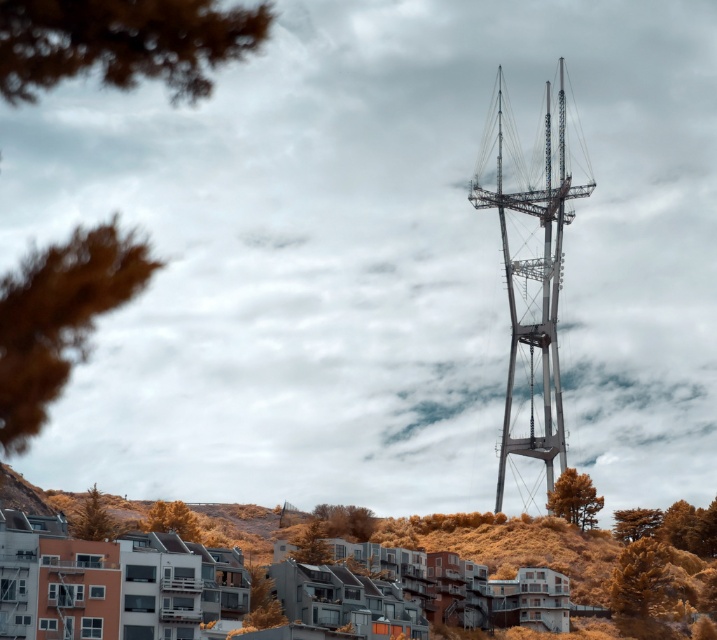
Locate an element on the screen. This screenshot has width=717, height=640. brown fuzzy bush at left is located at coordinates (57, 317).

Is point (24, 268) farther from camera compared to point (326, 524)?

No, (24, 268) is closer to viewer.

Which is in front, point (19, 358) or point (364, 529)?

Positioned in front is point (19, 358).

At what (x,y) coordinates should I click in order to perform the action: click on brown fuzzy bush at left. Please return your answer as a coordinate pair (x, y). Image resolution: width=717 pixels, height=640 pixels. Looking at the image, I should click on (57, 317).

In the scene shown: Which is above, golden textured tree at lower left or green textured tree at lower right?

golden textured tree at lower left is above.

Does golden textured tree at lower left lie behind green textured tree at lower right?

No, golden textured tree at lower left is in front of green textured tree at lower right.

Which is behind, point (250, 612) or point (637, 508)?

The point (637, 508) is behind.

Find the location of a particular element. This screenshot has height=640, width=717. golden textured tree at lower left is located at coordinates (262, 600).

In the scene shown: Can you confirm if green matte tree at lower right is positioned to the left of golden textured pine tree at lower left?

Incorrect, green matte tree at lower right is not on the left side of golden textured pine tree at lower left.

Who is positioned more to the right, green matte tree at lower right or golden textured pine tree at lower left?

green matte tree at lower right

Image resolution: width=717 pixels, height=640 pixels. Describe the element at coordinates (574, 499) in the screenshot. I see `green matte tree at lower right` at that location.

Find the location of `green matte tree at lower right`. green matte tree at lower right is located at coordinates (574, 499).